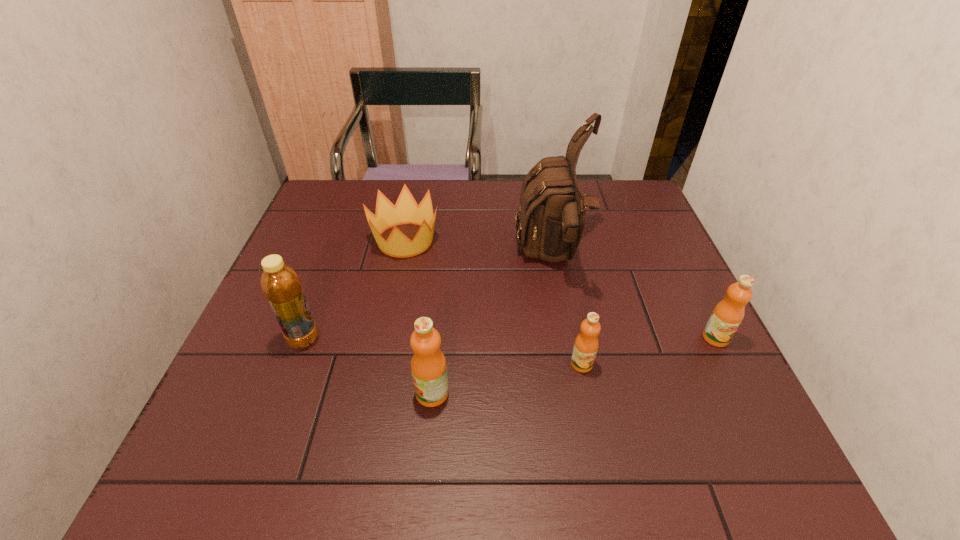
Where is `the nearest object`? This screenshot has height=540, width=960. the nearest object is located at coordinates (428, 364).

Locate an element on the screen. Image resolution: width=960 pixels, height=540 pixels. the leftmost orange juice is located at coordinates (428, 364).

What are the coordinates of `the shortest orange juice` in the screenshot? It's located at (586, 344).

This screenshot has width=960, height=540. What are the coordinates of `the fifth farthest object` in the screenshot? It's located at (586, 344).

Where is `the rightmost object`? The height and width of the screenshot is (540, 960). the rightmost object is located at coordinates (728, 314).

Find the location of a particular element. the second tallest orange juice is located at coordinates (728, 314).

This screenshot has width=960, height=540. In order to click on crown in this screenshot , I will do `click(406, 211)`.

Locate an element on the screen. the tallest object is located at coordinates (552, 209).

Find the location of a particular element. This screenshot has height=540, width=960. the leftmost object is located at coordinates (280, 283).

The height and width of the screenshot is (540, 960). In order to click on vacant region located 0.350m on the front label of the nearest object in this screenshot , I will do `click(241, 393)`.